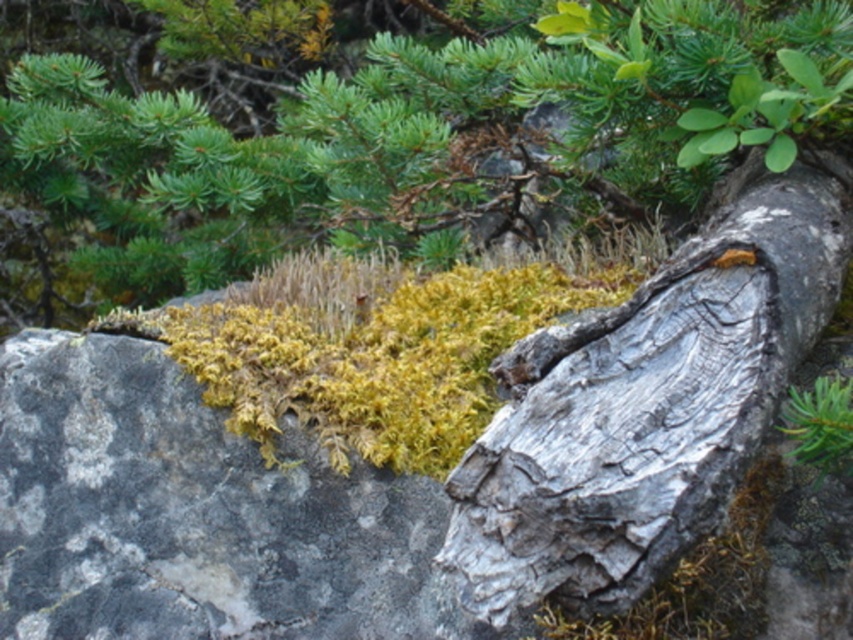
Based on the coordinates provided in the scene description, where is the green leafy tree at upper center located?

The green leafy tree at upper center is located at point coordinates of (430, 136).